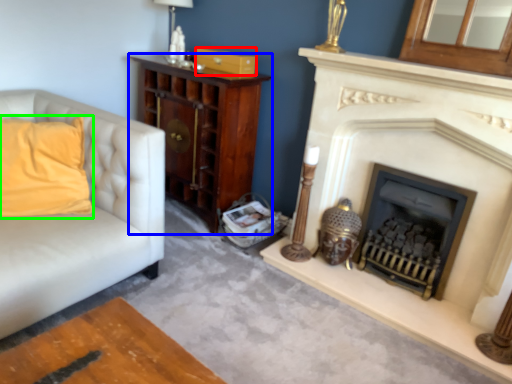
Question: Based on their relative distances, which object is nearer to drawer (highlighted by a red box)? Choose from cabinetry (highlighted by a blue box) and pillow (highlighted by a green box).

Choices:
 (A) cabinetry
 (B) pillow

Answer: (A)